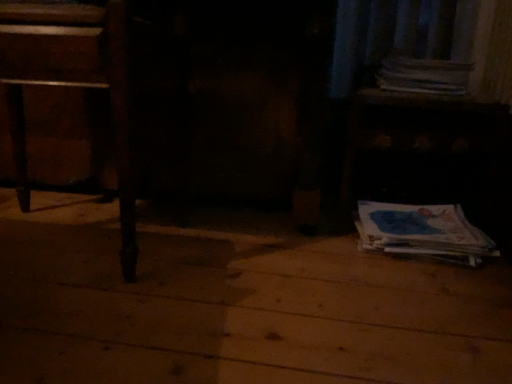
Question: Is blue paper at lower right, the second paperback book viewed from the top, wider than wooden table at lower right?

Choices:
 (A) yes
 (B) no

Answer: (B)

Question: Can you confirm if blue paper at lower right, the first paperback book ordered from the bottom, is taller than wooden table at lower right?

Choices:
 (A) yes
 (B) no

Answer: (B)

Question: Considering the relative sizes of blue paper at lower right, the second paperback book viewed from the top, and wooden table at lower right in the image provided, is blue paper at lower right, the second paperback book viewed from the top, thinner than wooden table at lower right?

Choices:
 (A) yes
 (B) no

Answer: (A)

Question: From the image's perspective, does blue paper at lower right, the second paperback book viewed from the top, appear lower than wooden table at lower right?

Choices:
 (A) yes
 (B) no

Answer: (A)

Question: Does blue paper at lower right, the first paperback book ordered from the bottom, have a lesser height compared to wooden table at lower right?

Choices:
 (A) no
 (B) yes

Answer: (B)

Question: Does blue paper at lower right, the second paperback book viewed from the top, have a larger size compared to wooden table at lower right?

Choices:
 (A) no
 (B) yes

Answer: (A)

Question: Is white paper at upper right, which appears as the 2th paperback book when ordered from the bottom, at the left side of blue paper at lower right, the second paperback book viewed from the top?

Choices:
 (A) yes
 (B) no

Answer: (B)

Question: From a real-world perspective, is white paper at upper right, which appears as the 2th paperback book when ordered from the bottom, below blue paper at lower right, the second paperback book viewed from the top?

Choices:
 (A) no
 (B) yes

Answer: (A)

Question: Can you confirm if white paper at upper right, the 1th paperback book positioned from the top, is thinner than blue paper at lower right, the first paperback book ordered from the bottom?

Choices:
 (A) no
 (B) yes

Answer: (A)

Question: Is white paper at upper right, which appears as the 2th paperback book when ordered from the bottom, shorter than blue paper at lower right, the first paperback book ordered from the bottom?

Choices:
 (A) no
 (B) yes

Answer: (A)

Question: Could you tell me if white paper at upper right, the 1th paperback book positioned from the top, is facing blue paper at lower right, the second paperback book viewed from the top?

Choices:
 (A) yes
 (B) no

Answer: (B)

Question: Are white paper at upper right, the 1th paperback book positioned from the top, and blue paper at lower right, the first paperback book ordered from the bottom, located far from each other?

Choices:
 (A) yes
 (B) no

Answer: (B)

Question: From a real-world perspective, is white paper at upper right, the 1th paperback book positioned from the top, under wooden table at lower right?

Choices:
 (A) yes
 (B) no

Answer: (B)